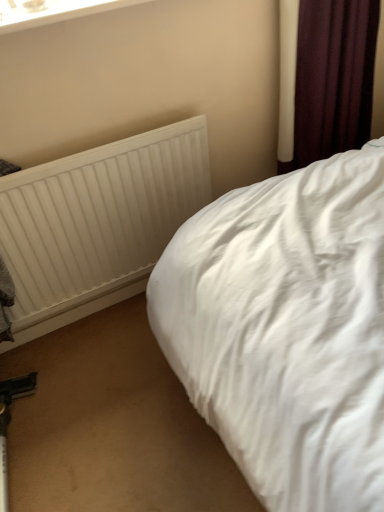
The height and width of the screenshot is (512, 384). In order to click on dark purple fabric at upper right in this screenshot , I will do `click(327, 80)`.

The height and width of the screenshot is (512, 384). I want to click on white textured radiator at upper left, so click(x=97, y=223).

I want to click on dark purple fabric at upper right, so click(327, 80).

Is white textured radiator at upper left located within white cotton bed at center?

Actually, white textured radiator at upper left is outside white cotton bed at center.

Which is in front, point (259, 287) or point (2, 196)?

Positioned in front is point (259, 287).

Image resolution: width=384 pixels, height=512 pixels. I want to click on radiator lying on the left of white cotton bed at center, so click(x=97, y=223).

What's the angular difference between white cotton bed at center and white textured radiator at upper left's facing directions?

They differ by 89.1 degrees in their facing directions.

Based on the photo, does white textured radiator at upper left turn towards dark purple fabric at upper right?

No, white textured radiator at upper left does not turn towards dark purple fabric at upper right.

From a real-world perspective, is white textured radiator at upper left physically below dark purple fabric at upper right?

Correct, in the physical world, white textured radiator at upper left is lower than dark purple fabric at upper right.

Who is taller, white textured radiator at upper left or dark purple fabric at upper right?

With more height is dark purple fabric at upper right.

Between white textured radiator at upper left and white cotton bed at center, which one has less height?

With less height is white textured radiator at upper left.

Would you say white textured radiator at upper left is inside or outside white cotton bed at center?

white textured radiator at upper left is outside white cotton bed at center.

Does white textured radiator at upper left turn towards white cotton bed at center?

Yes, white textured radiator at upper left is facing white cotton bed at center.

Can you confirm if white textured radiator at upper left is shorter than white plastic window frame at upper left?

No, white textured radiator at upper left is not shorter than white plastic window frame at upper left.

Does white textured radiator at upper left turn towards white plastic window frame at upper left?

No, white textured radiator at upper left does not turn towards white plastic window frame at upper left.

In the scene shown: From the image's perspective, relative to white plastic window frame at upper left, is white textured radiator at upper left above or below?

From the image's perspective, white textured radiator at upper left appears below white plastic window frame at upper left.

Considering the relative sizes of white textured radiator at upper left and white plastic window frame at upper left in the image provided, is white textured radiator at upper left smaller than white plastic window frame at upper left?

No.

Who is smaller, white cotton bed at center or white plastic window frame at upper left?

white plastic window frame at upper left.

Is white cotton bed at center in front of white plastic window frame at upper left?

Yes, white cotton bed at center is closer to the viewer.

Between white cotton bed at center and white plastic window frame at upper left, which one appears on the right side from the viewer's perspective?

white cotton bed at center.

Who is more distant, dark purple fabric at upper right or white textured radiator at upper left?

dark purple fabric at upper right is behind.

Which is in front, point (359, 117) or point (70, 233)?

The point (70, 233) is more forward.

Would you consider dark purple fabric at upper right to be distant from white textured radiator at upper left?

Actually, dark purple fabric at upper right and white textured radiator at upper left are a little close together.

From a real-world perspective, which object rests below the other?

white textured radiator at upper left, from a real-world perspective.

How different are the orientations of white plastic window frame at upper left and white textured radiator at upper left in degrees?

0.24 degrees.

Considering the relative sizes of white plastic window frame at upper left and white textured radiator at upper left in the image provided, is white plastic window frame at upper left wider than white textured radiator at upper left?

Correct, the width of white plastic window frame at upper left exceeds that of white textured radiator at upper left.

Would you say white plastic window frame at upper left is inside or outside white textured radiator at upper left?

white plastic window frame at upper left is located beyond the bounds of white textured radiator at upper left.

You are a GUI agent. You are given a task and a screenshot of the screen. Output one action in this format:
    pyautogui.click(x=<x>, y=<y>)
    Task: Click on the radiator below the white cotton bed at center (from a real-world perspective)
    The image size is (384, 512).
    Given the screenshot: What is the action you would take?
    pyautogui.click(x=97, y=223)

Identify the location of radiator on the left side of dark purple fabric at upper right. (97, 223).

Which object lies nearer to the anchor point white textured radiator at upper left, white cotton bed at center or dark purple fabric at upper right?

Based on the image, white cotton bed at center appears to be nearer to white textured radiator at upper left.

Based on their spatial positions, is white textured radiator at upper left or dark purple fabric at upper right further from white cotton bed at center?

dark purple fabric at upper right.

Looking at the image, which one is located closer to white cotton bed at center, white textured radiator at upper left or white plastic window frame at upper left?

Based on the image, white textured radiator at upper left appears to be nearer to white cotton bed at center.

Based on the photo, when comparing their distances from white cotton bed at center, does white plastic window frame at upper left or dark purple fabric at upper right seem closer?

dark purple fabric at upper right.

Considering their positions, is white textured radiator at upper left positioned further to white plastic window frame at upper left than dark purple fabric at upper right?

dark purple fabric at upper right is positioned further to the anchor white plastic window frame at upper left.

Looking at the image, which one is located closer to white plastic window frame at upper left, white cotton bed at center or dark purple fabric at upper right?

dark purple fabric at upper right lies closer to white plastic window frame at upper left than the other object.

Considering their positions, is white cotton bed at center positioned further to white textured radiator at upper left than white plastic window frame at upper left?

white plastic window frame at upper left is positioned further to the anchor white textured radiator at upper left.

From the image, which object appears to be nearer to white textured radiator at upper left, dark purple fabric at upper right or white plastic window frame at upper left?

white plastic window frame at upper left.

Locate an element on the screen. The image size is (384, 512). window frame located between white cotton bed at center and white textured radiator at upper left in the depth direction is located at coordinates (53, 12).

I want to click on window frame between white cotton bed at center and dark purple fabric at upper right from front to back, so click(x=53, y=12).

This screenshot has width=384, height=512. Find the location of `window frame situated between white textured radiator at upper left and dark purple fabric at upper right from left to right`. window frame situated between white textured radiator at upper left and dark purple fabric at upper right from left to right is located at coordinates (53, 12).

You are a GUI agent. You are given a task and a screenshot of the screen. Output one action in this format:
    pyautogui.click(x=<x>, y=<y>)
    Task: Click on the radiator between white cotton bed at center and dark purple fabric at upper right along the z-axis
    
    Given the screenshot: What is the action you would take?
    pyautogui.click(x=97, y=223)